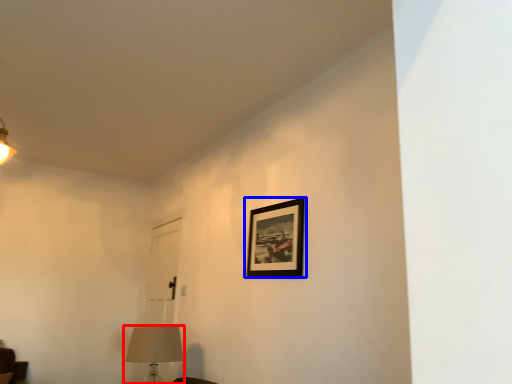
Question: Which object appears farthest to the camera in this image, table lamp (highlighted by a red box) or picture frame (highlighted by a blue box)?

Choices:
 (A) table lamp
 (B) picture frame

Answer: (A)